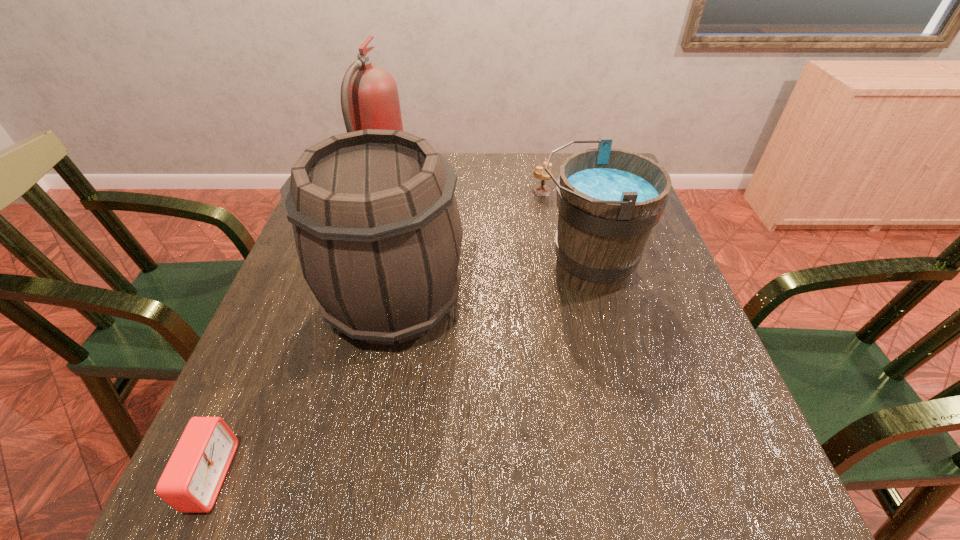
The width and height of the screenshot is (960, 540). I want to click on object positioned at the right edge, so click(x=609, y=200).

Find the location of a particular element. The height and width of the screenshot is (540, 960). object present at the far left corner is located at coordinates (369, 96).

You are a GUI agent. You are given a task and a screenshot of the screen. Output one action in this format:
    pyautogui.click(x=<x>, y=<y>)
    Task: Click on the object that is at the near left corner
    
    Given the screenshot: What is the action you would take?
    pyautogui.click(x=190, y=483)

At what (x,y) coordinates should I click in order to perform the action: click on free space at the far edge. Please return your answer as a coordinate pair (x, y). The height and width of the screenshot is (540, 960). Looking at the image, I should click on (516, 155).

The image size is (960, 540). Find the location of `vacant area at the left edge of the desktop`. vacant area at the left edge of the desktop is located at coordinates point(297,330).

This screenshot has width=960, height=540. I want to click on free space at the right edge of the desktop, so click(x=674, y=292).

Locate an element on the screen. vacant space at the near right corner of the desktop is located at coordinates (708, 531).

Locate an element on the screen. The height and width of the screenshot is (540, 960). vacant area that lies between the third tallest object and the left wine bucket is located at coordinates (491, 285).

At what (x,y) coordinates should I click in order to perform the action: click on vacant space that is in between the taller wine bucket and the alarm clock. Please return your answer as a coordinate pair (x, y). The width and height of the screenshot is (960, 540). Looking at the image, I should click on (302, 389).

At what (x,y) coordinates should I click in order to perform the action: click on empty space between the nearest object and the third shortest object. Please return your answer as a coordinate pair (x, y). The width and height of the screenshot is (960, 540). Looking at the image, I should click on (398, 373).